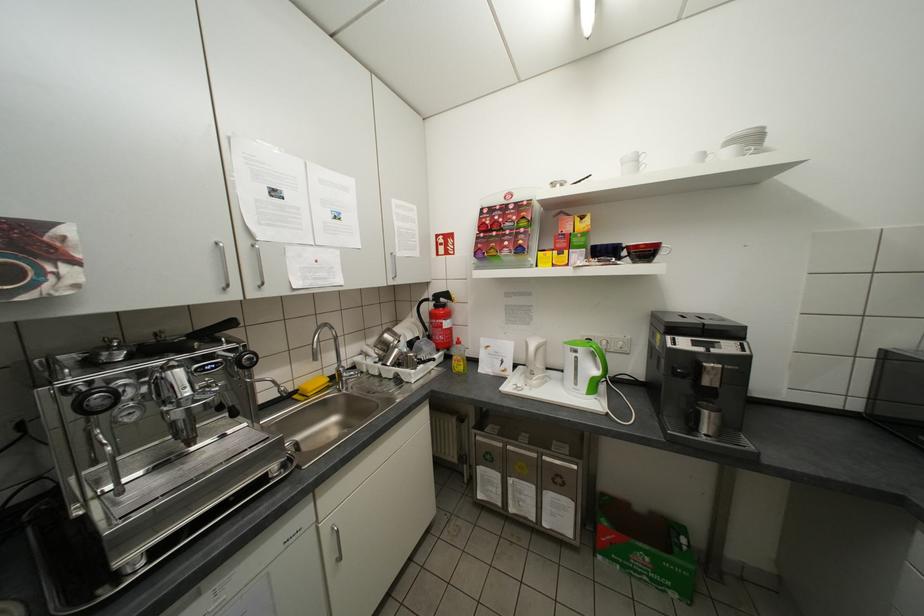
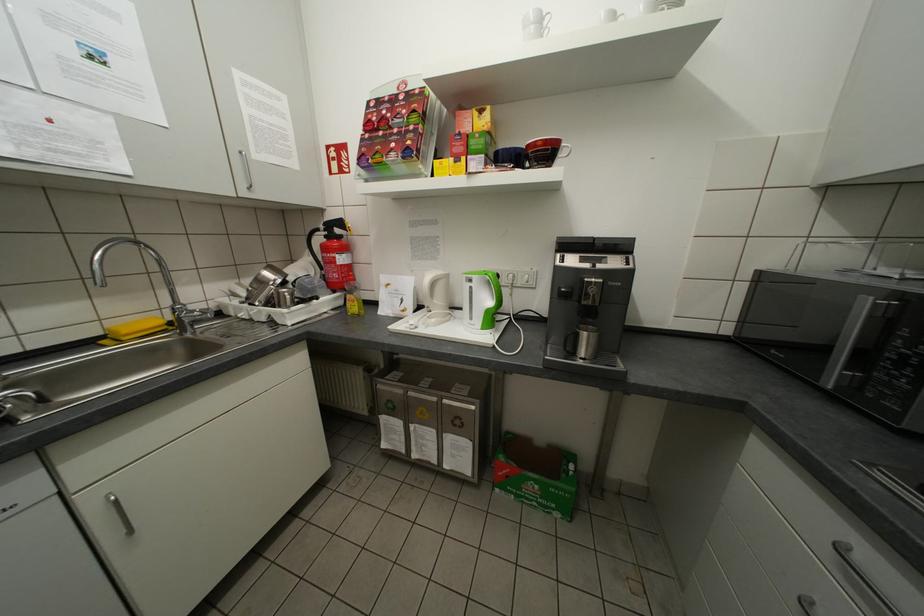
Locate, in the second image, the point that corresponds to (x=537, y=435) in the first image.

(440, 379)